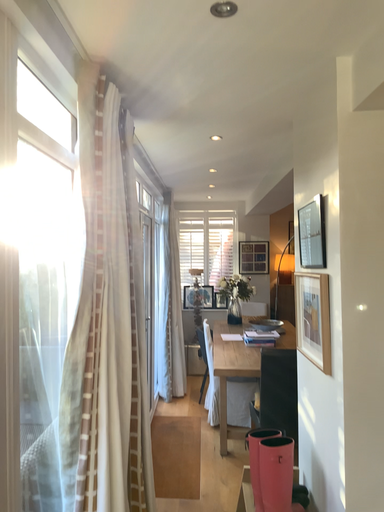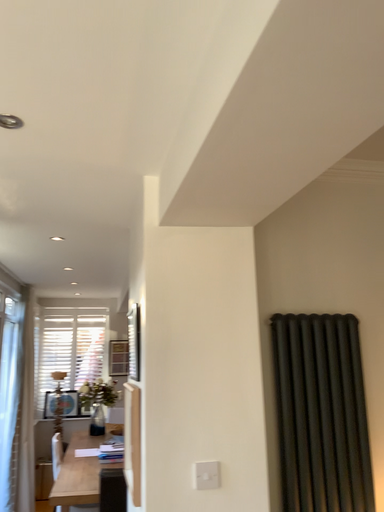
Question: Which way did the camera rotate in the video?

Choices:
 (A) rotated downward
 (B) rotated upward

Answer: (B)